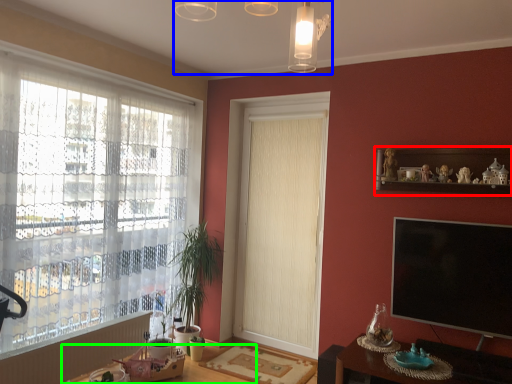
Question: Estimate the real-world distances between objects in this image. Which object is farther from shelf (highlighted by a red box), light fixture (highlighted by a blue box) or round table (highlighted by a green box)?

Choices:
 (A) light fixture
 (B) round table

Answer: (B)